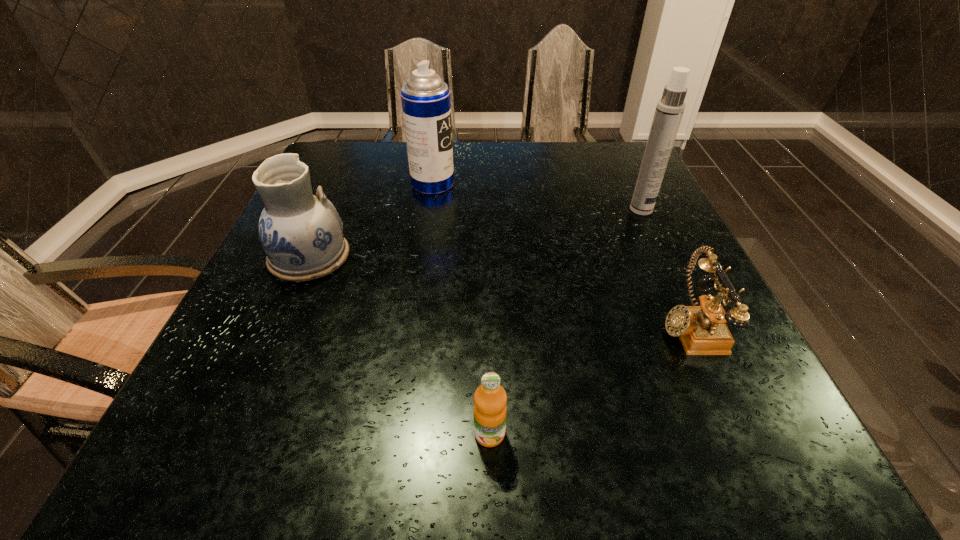
You are a GUI agent. You are given a task and a screenshot of the screen. Output one action in this format:
    pyautogui.click(x=<x>, y=<y>)
    Task: Click on the fourth nearest object
    This screenshot has height=540, width=960.
    Given the screenshot: What is the action you would take?
    pyautogui.click(x=670, y=108)

This screenshot has width=960, height=540. What are the coordinates of `the nearer aerosol can` in the screenshot? It's located at (670, 108).

Find the location of a particular element. the farthest object is located at coordinates (426, 105).

The image size is (960, 540). I want to click on the farther aerosol can, so click(x=426, y=105).

The width and height of the screenshot is (960, 540). I want to click on the third tallest object, so click(x=302, y=235).

Find the location of `the third nearest object`. the third nearest object is located at coordinates (302, 235).

Where is `the fourth farthest object`? the fourth farthest object is located at coordinates (702, 330).

Find the location of a particular element. This screenshot has width=960, height=540. orange juice is located at coordinates (490, 399).

Where is `the nearest object`? the nearest object is located at coordinates (490, 399).

The height and width of the screenshot is (540, 960). What are the coordinates of `free space located 0.070m on the back of the second farthest object` in the screenshot? It's located at (632, 188).